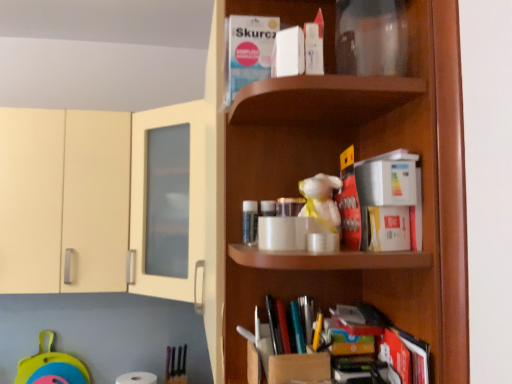
Question: Is red matte book at center, positioned as the second book in right-to-left order, outside of white matte book at upper center, acting as the second book starting from the left?

Choices:
 (A) no
 (B) yes

Answer: (B)

Question: Does red matte book at center, positioned as the second book in right-to-left order, appear on the right side of white matte book at upper center, the 2th book in the top-to-bottom sequence?

Choices:
 (A) yes
 (B) no

Answer: (A)

Question: From a real-world perspective, is red matte book at center, acting as the 3th book starting from the top, below white matte book at upper center, which is the 4th book from bottom to top?

Choices:
 (A) yes
 (B) no

Answer: (A)

Question: Is red matte book at center, placed as the fourth book when sorted from left to right, thinner than white matte book at upper center, which is the 4th book from bottom to top?

Choices:
 (A) no
 (B) yes

Answer: (B)

Question: From a real-world perspective, is red matte book at center, acting as the 3th book starting from the top, on top of white matte book at upper center, acting as the second book starting from the left?

Choices:
 (A) no
 (B) yes

Answer: (A)

Question: From a real-world perspective, relative to white matte book at upper center, which is counted as the 1th book, starting from the top, is multicolored plastic books at lower center, the 4th book when ordered from top to bottom, vertically above or below?

Choices:
 (A) below
 (B) above

Answer: (A)

Question: Is multicolored plastic books at lower center, the third book when ordered from left to right, taller or shorter than white matte book at upper center, positioned as the fifth book in bottom-to-top order?

Choices:
 (A) short
 (B) tall

Answer: (A)

Question: Is point (297, 316) closer or farther from the camera than point (232, 29)?

Choices:
 (A) closer
 (B) farther

Answer: (B)

Question: From the image's perspective, is multicolored plastic books at lower center, the third book when ordered from left to right, positioned above or below white matte book at upper center, which is counted as the 1th book, starting from the top?

Choices:
 (A) above
 (B) below

Answer: (B)

Question: Is point (423, 360) positioned closer to the camera than point (281, 72)?

Choices:
 (A) closer
 (B) farther

Answer: (A)

Question: Which is correct: hardcover book at lower right, which is counted as the 1th book, starting from the bottom, is inside white matte book at upper center, which is the fourth book in right-to-left order, or outside of it?

Choices:
 (A) inside
 (B) outside

Answer: (B)

Question: Considering the relative positions of hardcover book at lower right, which is counted as the 1th book, starting from the bottom, and white matte book at upper center, which is the 4th book from bottom to top, in the image provided, is hardcover book at lower right, which is counted as the 1th book, starting from the bottom, to the left or to the right of white matte book at upper center, which is the 4th book from bottom to top,?

Choices:
 (A) left
 (B) right

Answer: (B)

Question: From a real-world perspective, relative to white matte book at upper center, which is the 4th book from bottom to top, is hardcover book at lower right, which is counted as the 1th book, starting from the bottom, vertically above or below?

Choices:
 (A) below
 (B) above

Answer: (A)

Question: Visually, is white matte toilet paper at lower left positioned to the left or to the right of white matte book at upper center, acting as the second book starting from the left?

Choices:
 (A) left
 (B) right

Answer: (A)

Question: In the image, is white matte toilet paper at lower left positioned in front of or behind white matte book at upper center, the 2th book in the top-to-bottom sequence?

Choices:
 (A) front
 (B) behind

Answer: (B)